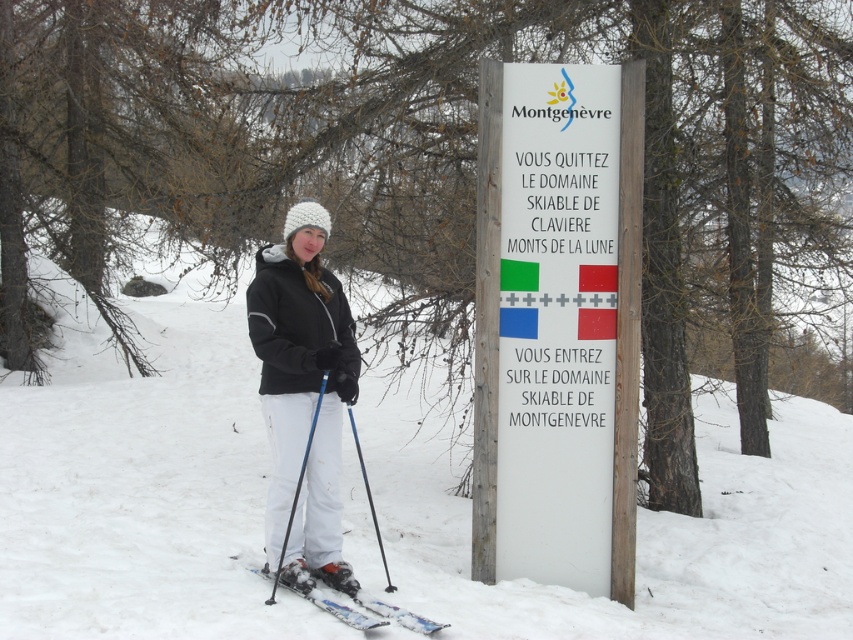
Question: From the image, what is the correct spatial relationship of white powder snow at center in relation to white fleece jacket at center?

Choices:
 (A) left
 (B) right

Answer: (B)

Question: Can you confirm if white powder snow at center is wider than white fleece jacket at center?

Choices:
 (A) no
 (B) yes

Answer: (B)

Question: Estimate the real-world distances between objects in this image. Which object is farther from the black plastic ski pole at center?

Choices:
 (A) white plastic ski at lower center
 (B) white powder snow at center
 (C) blue plastic ski pole at lower center

Answer: (B)

Question: Which point appears farthest from the camera in this image?

Choices:
 (A) (323, 548)
 (B) (80, 416)

Answer: (B)

Question: Can you confirm if white plastic sign at center is wider than black plastic ski pole at center?

Choices:
 (A) no
 (B) yes

Answer: (B)

Question: Which point is farther to the camera?

Choices:
 (A) white plastic ski at lower center
 (B) white plastic sign at center
 (C) white powder snow at center

Answer: (B)